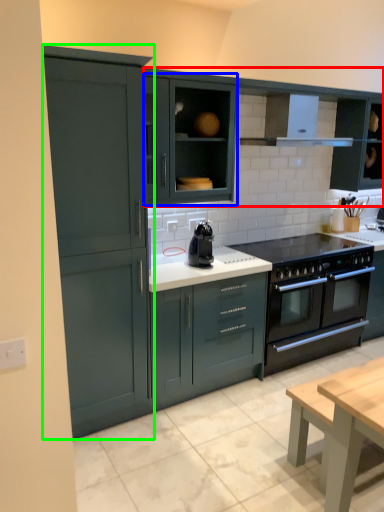
Question: Considering the real-world distances, which object is farthest from cabinetry (highlighted by a red box)? cabinetry (highlighted by a blue box) or cabinetry (highlighted by a green box)?

Choices:
 (A) cabinetry
 (B) cabinetry

Answer: (B)